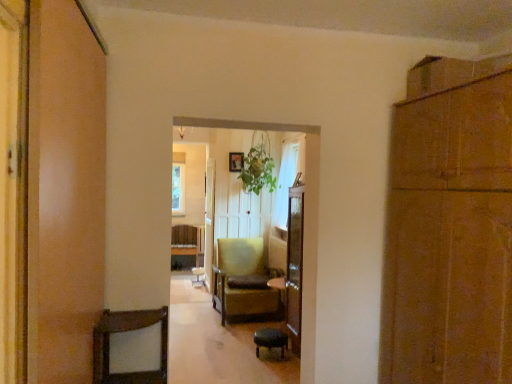
Question: Would you say yellow fabric chair at center contains green leafy plant at center?

Choices:
 (A) yes
 (B) no

Answer: (B)

Question: From a real-world perspective, is yellow fabric chair at center positioned over green leafy plant at center based on gravity?

Choices:
 (A) yes
 (B) no

Answer: (B)

Question: Is yellow fabric chair at center facing away from green leafy plant at center?

Choices:
 (A) yes
 (B) no

Answer: (B)

Question: Is yellow fabric chair at center positioned far away from green leafy plant at center?

Choices:
 (A) no
 (B) yes

Answer: (B)

Question: From a real-world perspective, does yellow fabric chair at center sit lower than green leafy plant at center?

Choices:
 (A) yes
 (B) no

Answer: (A)

Question: Looking at the image, does brown cardboard cabinet at right seem bigger or smaller compared to green leafy plant at center?

Choices:
 (A) small
 (B) big

Answer: (B)

Question: From a real-world perspective, is brown cardboard cabinet at right physically located above or below green leafy plant at center?

Choices:
 (A) above
 (B) below

Answer: (B)

Question: Is point (506, 284) closer or farther from the camera than point (244, 183)?

Choices:
 (A) farther
 (B) closer

Answer: (B)

Question: Is brown cardboard cabinet at right inside or outside of green leafy plant at center?

Choices:
 (A) inside
 (B) outside

Answer: (B)

Question: Is brown leather bar stool at lower center in front of or behind yellow fabric chair at center in the image?

Choices:
 (A) front
 (B) behind

Answer: (A)

Question: Is brown leather bar stool at lower center wider or thinner than yellow fabric chair at center?

Choices:
 (A) wide
 (B) thin

Answer: (B)

Question: Based on their sizes in the image, would you say brown leather bar stool at lower center is bigger or smaller than yellow fabric chair at center?

Choices:
 (A) big
 (B) small

Answer: (B)

Question: Do you think brown leather bar stool at lower center is within yellow fabric chair at center, or outside of it?

Choices:
 (A) inside
 (B) outside

Answer: (B)

Question: Would you say green leafy plant at center is inside or outside brown cardboard cabinet at right?

Choices:
 (A) outside
 (B) inside

Answer: (A)

Question: Looking at the image, does green leafy plant at center seem bigger or smaller compared to brown cardboard cabinet at right?

Choices:
 (A) big
 (B) small

Answer: (B)